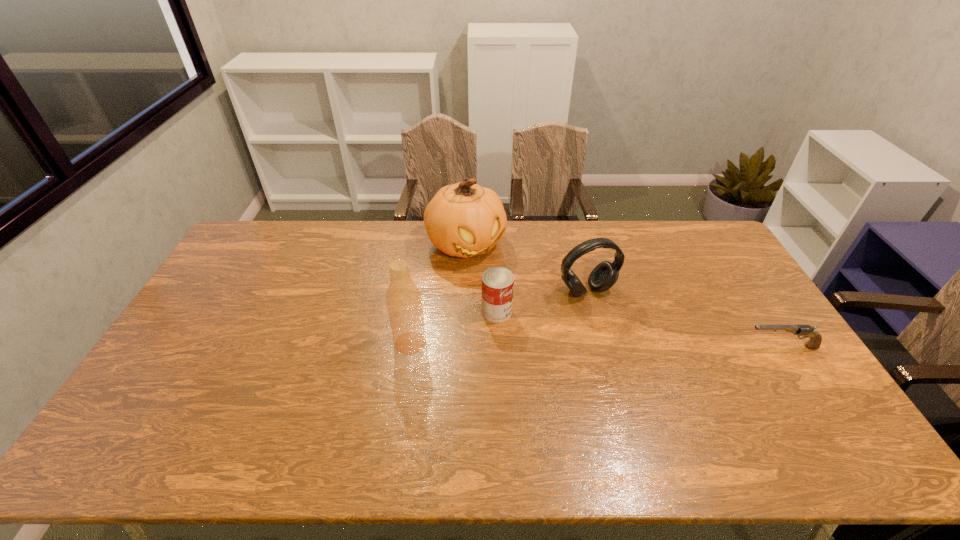
Where is `vacant space on the desktop that is between the beer bottle and the gun and is positioned on the earcups of the headset`? The image size is (960, 540). vacant space on the desktop that is between the beer bottle and the gun and is positioned on the earcups of the headset is located at coordinates (623, 345).

The width and height of the screenshot is (960, 540). In order to click on free space on the desktop that is between the beer bottle and the rightmost object and is positioned on the front face of the farthest object in this screenshot , I will do `click(543, 344)`.

At what (x,y) coordinates should I click in order to perform the action: click on vacant space on the desktop that is between the beer bottle and the rightmost object and is positioned on the front label of the can. Please return your answer as a coordinate pair (x, y). Image resolution: width=960 pixels, height=540 pixels. Looking at the image, I should click on (571, 345).